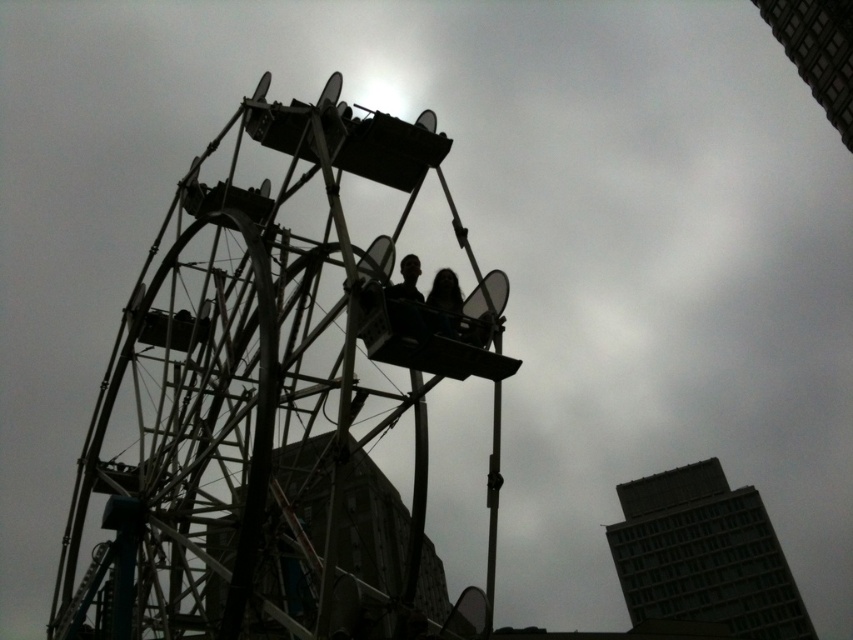
You are a photographer planning to take a photo of the Ferris wheel and its surroundings. You want to ensure that both the gray concrete building at center and the silhouette fabric at center are clearly visible in the frame. Based on their positions, which object should you adjust your focus on to prioritize the one closer to you?

The gray concrete building at center is closer to you than the silhouette fabric at center, so you should adjust your focus on the gray concrete building at center to prioritize it.

You are standing in front of the Ferris wheel and notice the gray concrete building at center and the silhouette fabric at center. Which object is closer to the ground?

The gray concrete building at center is located below the silhouette fabric at center, so it is closer to the ground.